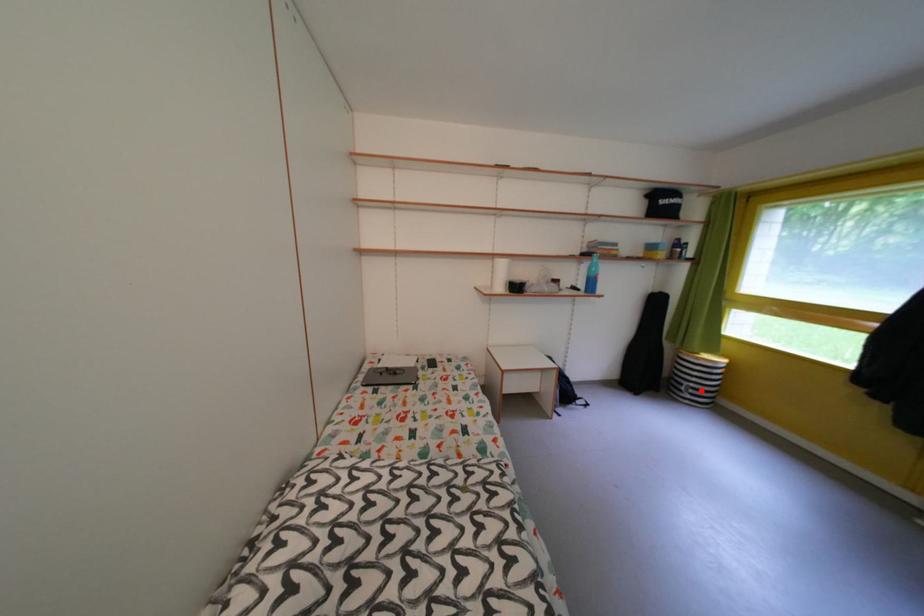
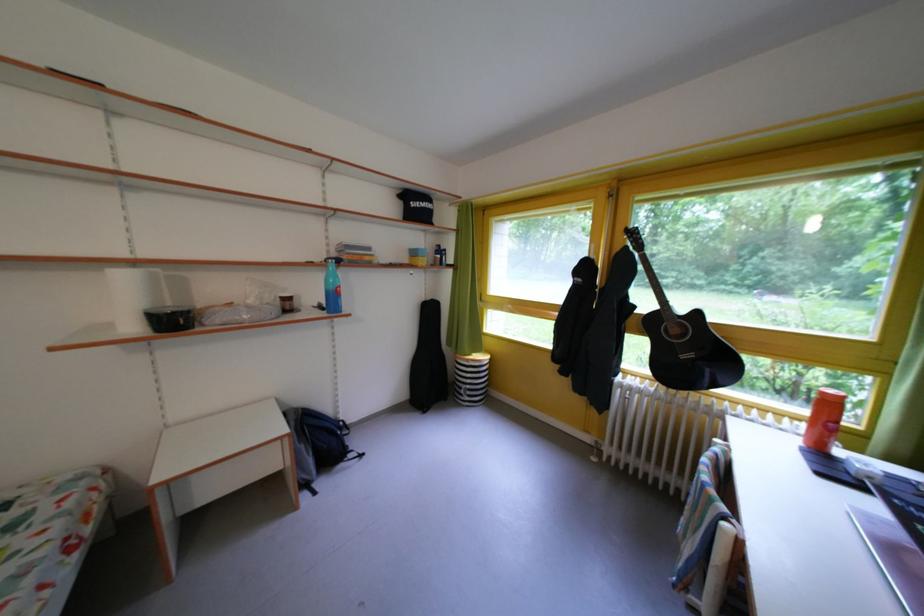
In the second image, find the point that corresponds to the highlighted location in the first image.

(478, 392)